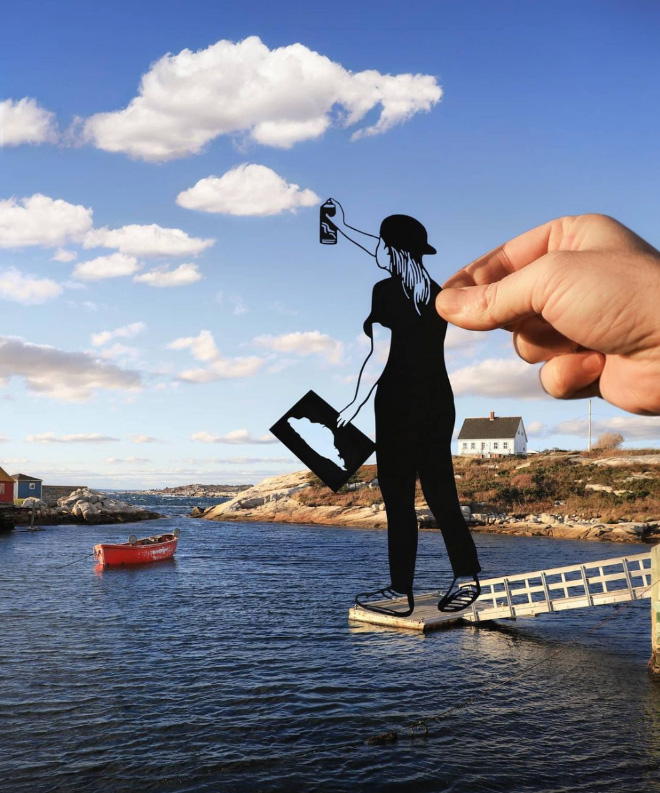
You are a GUI agent. You are given a task and a screenshot of the screen. Output one action in this format:
    pyautogui.click(x=<x>, y=<y>)
    Task: Click on the white walls
    Image resolution: width=660 pixels, height=793 pixels.
    Given the screenshot: What is the action you would take?
    pyautogui.click(x=509, y=446)